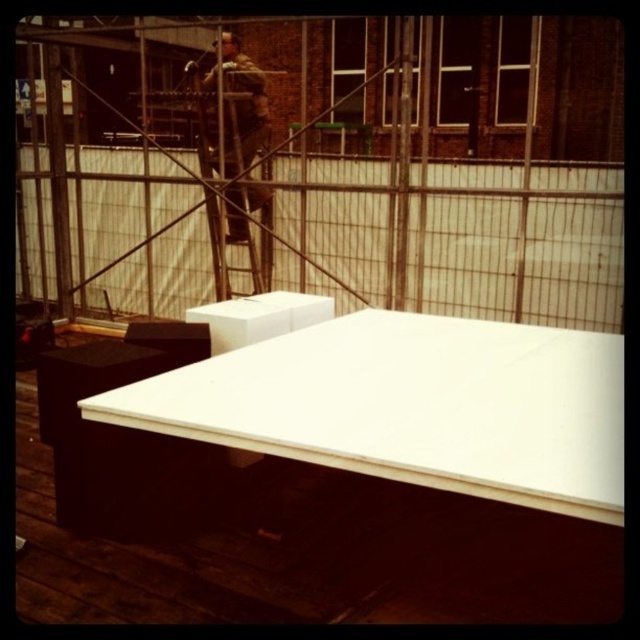
Who is more distant from viewer, (548, 348) or (236, 92)?

The point (236, 92) is more distant.

Between point (404, 465) and point (268, 198), which one is positioned in front?

Point (404, 465) is more forward.

Does point (504, 484) lie in front of point (248, 250)?

Yes, it is.

Identify the location of white matte table at center. (412, 406).